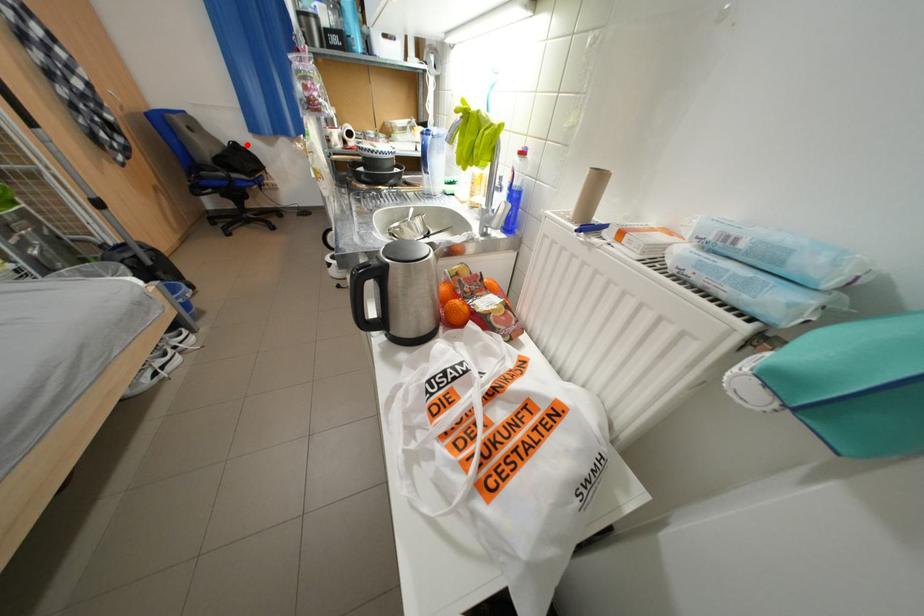
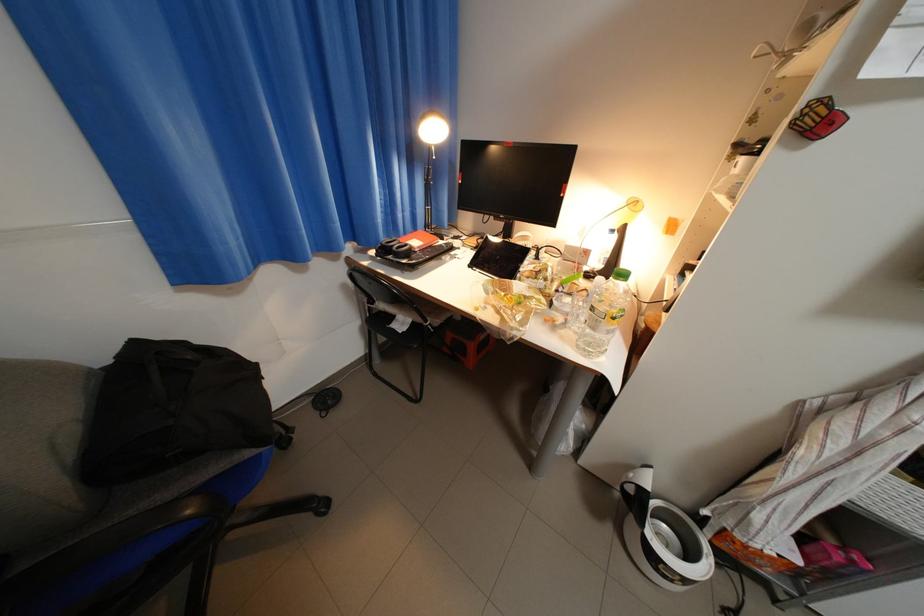
Question: I am providing you with two images of the same scene from different viewpoints. Given a red point in image1, look at the same physical point in image2. Is it:

Choices:
 (A) Closer to the viewpoint
 (B) Farther from the viewpoint

Answer: (B)